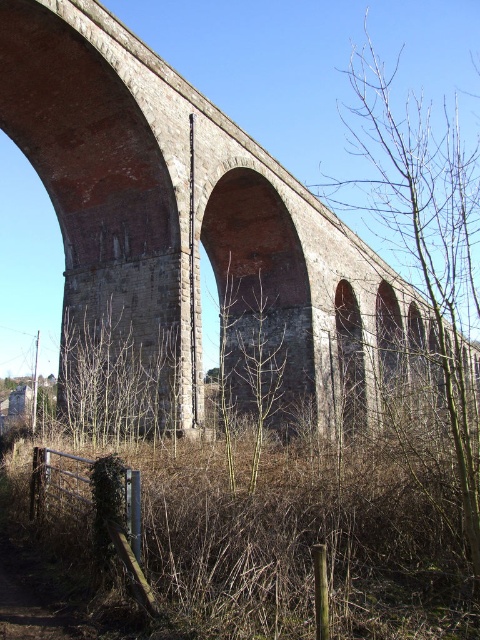
Question: Does red brick arch at center have a smaller size compared to bare branches at right?

Choices:
 (A) yes
 (B) no

Answer: (A)

Question: In this image, where is red brick arch at center located relative to bare branches at right?

Choices:
 (A) right
 (B) left

Answer: (B)

Question: Which point appears farthest from the camera in this image?

Choices:
 (A) (156, 195)
 (B) (434, 236)

Answer: (B)

Question: Can you confirm if red brick arch at center is thinner than bare branches at right?

Choices:
 (A) no
 (B) yes

Answer: (A)